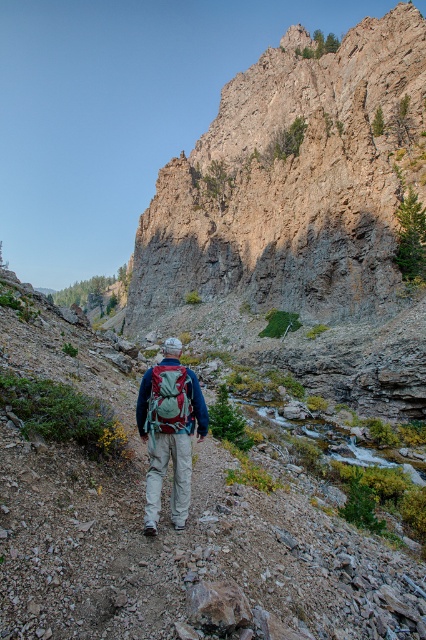
Looking at this image, you are a hiker who wants to place both the matte green backpack at center and the teal fabric backpack at center on the rocky trail. Which backpack should you place first if you want to arrange them from left to right as per their current positions?

The matte green backpack at center should be placed first on the left side since it is already positioned to the left of the teal fabric backpack at center.

You are a hiker planning to climb the rugged stone cliff at upper center. You have a teal fabric backpack at center. Will the backpack be in your line of sight when you reach the top of the cliff?

The rugged stone cliff at upper center is located above the teal fabric backpack at center, so when you reach the top of the cliff, the backpack will be below you and likely out of your direct line of sight unless you look down.

You are a hiker trying to navigate the mountain trail. You notice the rugged stone cliff at upper center and the matte green backpack at center. Which object is wider?

The rugged stone cliff at upper center is wider than the matte green backpack at center.